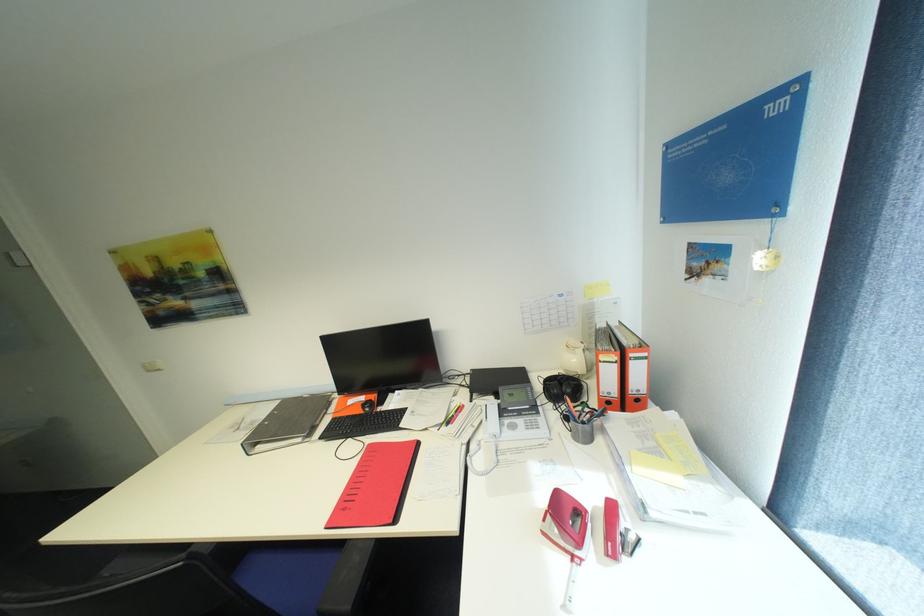
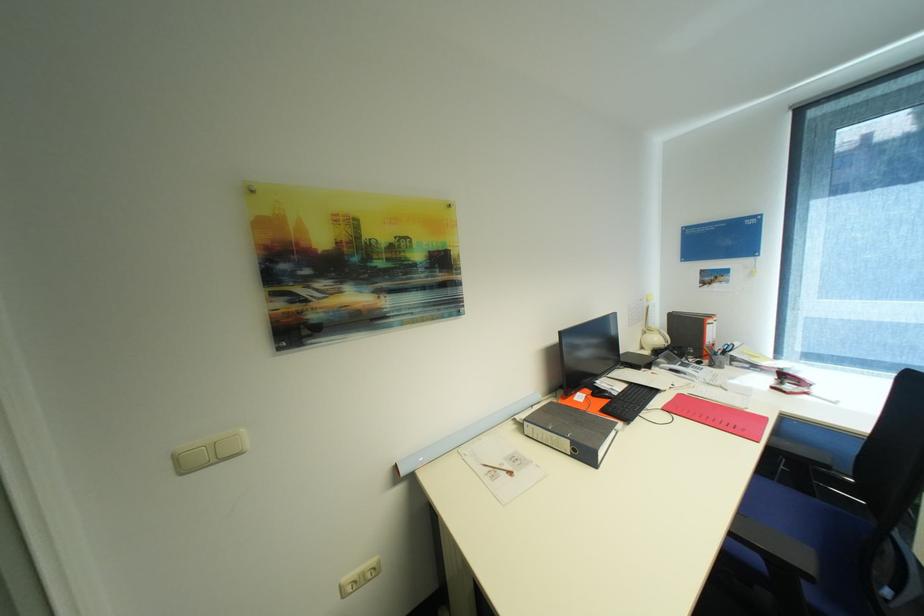
Where in the second image is the point corresponding to [353,394] from the first image?

(581, 392)